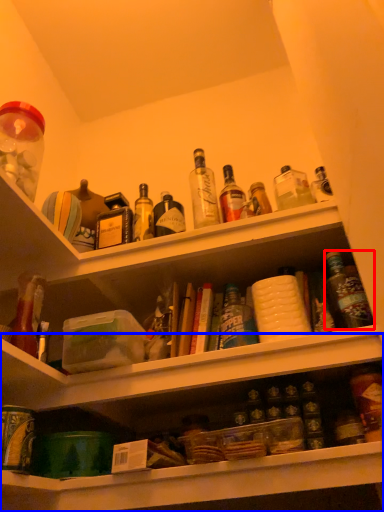
Question: Which object appears closest to the camera in this image, bottle (highlighted by a red box) or shelf (highlighted by a blue box)?

Choices:
 (A) bottle
 (B) shelf

Answer: (B)